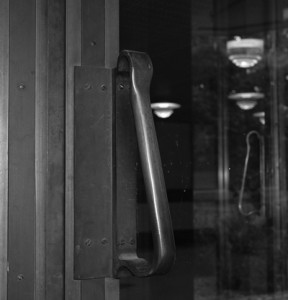
The width and height of the screenshot is (288, 300). In order to click on door mount in this screenshot , I will do `click(98, 139)`.